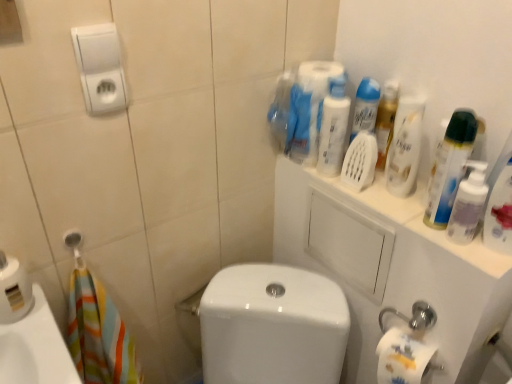
Find the location of a particular element. This screenshot has width=512, height=384. translucent plastic spray bottle at upper right, the fourth cleaning product from the left is located at coordinates (499, 213).

Where is `translucent plastic bottle at upper right, the 2th cleaning product positioned from the right`? The image size is (512, 384). translucent plastic bottle at upper right, the 2th cleaning product positioned from the right is located at coordinates (450, 167).

The width and height of the screenshot is (512, 384). Describe the element at coordinates (405, 146) in the screenshot. I see `white glossy shampoo at upper right, the third cleaning product when ordered from right to left` at that location.

Locate an element on the screen. Image resolution: width=512 pixels, height=384 pixels. translucent plastic bottle at upper right, which is counted as the fourth cleaning product, starting from the right is located at coordinates (333, 127).

Locate an element on the screen. translucent plastic spray bottle at upper right, the fourth cleaning product from the left is located at coordinates (499, 213).

From a real-world perspective, relative to translucent plastic bottle at upper right, which is counted as the fourth cleaning product, starting from the right, is white glossy shampoo at upper right, the third cleaning product when ordered from right to left, vertically above or below?

Clearly, from a real-world perspective, white glossy shampoo at upper right, the third cleaning product when ordered from right to left, is below translucent plastic bottle at upper right, which is counted as the fourth cleaning product, starting from the right.

Can you see white glossy shampoo at upper right, the third cleaning product when ordered from right to left, touching translucent plastic bottle at upper right, acting as the first cleaning product starting from the left?

No, white glossy shampoo at upper right, the third cleaning product when ordered from right to left, is not making contact with translucent plastic bottle at upper right, acting as the first cleaning product starting from the left.

Is point (398, 160) closer or farther from the camera than point (342, 92)?

Point (398, 160).

Would you say white glossy shampoo at upper right, the third cleaning product when ordered from right to left, is outside translucent plastic bottle at upper right, acting as the first cleaning product starting from the left?

white glossy shampoo at upper right, the third cleaning product when ordered from right to left, is positioned outside translucent plastic bottle at upper right, acting as the first cleaning product starting from the left.

From the image's perspective, who appears lower, translucent plastic spray bottle at upper right, the fourth cleaning product from the left, or translucent plastic bottle at upper right, the 2th cleaning product positioned from the right?

translucent plastic spray bottle at upper right, the fourth cleaning product from the left, appears lower in the image.

Is translucent plastic spray bottle at upper right, the fourth cleaning product from the left, not near translucent plastic bottle at upper right, the 3th cleaning product from the left?

No, there isn't a large distance between translucent plastic spray bottle at upper right, the fourth cleaning product from the left, and translucent plastic bottle at upper right, the 3th cleaning product from the left.

Considering the relative sizes of translucent plastic spray bottle at upper right, the fourth cleaning product from the left, and translucent plastic bottle at upper right, the 3th cleaning product from the left, in the image provided, is translucent plastic spray bottle at upper right, the fourth cleaning product from the left, bigger than translucent plastic bottle at upper right, the 3th cleaning product from the left,?

Yes, translucent plastic spray bottle at upper right, the fourth cleaning product from the left, is bigger than translucent plastic bottle at upper right, the 3th cleaning product from the left.

Who is more distant, translucent plastic spray bottle at upper right, the 1th cleaning product positioned from the right, or translucent plastic bottle at upper right, the 2th cleaning product positioned from the right?

translucent plastic bottle at upper right, the 2th cleaning product positioned from the right, is further away from the camera.

Considering the relative sizes of white glossy shampoo at upper right, the third cleaning product when ordered from right to left, and transparent plastic mouthwash at upper right in the image provided, is white glossy shampoo at upper right, the third cleaning product when ordered from right to left, bigger than transparent plastic mouthwash at upper right?

Indeed, white glossy shampoo at upper right, the third cleaning product when ordered from right to left, has a larger size compared to transparent plastic mouthwash at upper right.

Is white glossy shampoo at upper right, the third cleaning product when ordered from right to left, wider or thinner than transparent plastic mouthwash at upper right?

In the image, white glossy shampoo at upper right, the third cleaning product when ordered from right to left, appears to be wider than transparent plastic mouthwash at upper right.

From the image's perspective, is white glossy shampoo at upper right, the third cleaning product when ordered from right to left, positioned above or below transparent plastic mouthwash at upper right?

From the image's perspective, white glossy shampoo at upper right, the third cleaning product when ordered from right to left, appears above transparent plastic mouthwash at upper right.

Is transparent plastic mouthwash at upper right touching translucent plastic spray bottle at upper right, the fourth cleaning product from the left?

Indeed, transparent plastic mouthwash at upper right and translucent plastic spray bottle at upper right, the fourth cleaning product from the left, are beside each other and touching.

From the image's perspective, does transparent plastic mouthwash at upper right appear higher than translucent plastic spray bottle at upper right, the 1th cleaning product positioned from the right?

No, from the image's perspective, transparent plastic mouthwash at upper right is not over translucent plastic spray bottle at upper right, the 1th cleaning product positioned from the right.

Considering the positions of objects transparent plastic mouthwash at upper right and translucent plastic spray bottle at upper right, the fourth cleaning product from the left, in the image provided, who is more to the left, transparent plastic mouthwash at upper right or translucent plastic spray bottle at upper right, the fourth cleaning product from the left,?

Positioned to the left is transparent plastic mouthwash at upper right.

Is translucent plastic spray bottle at upper right, the 1th cleaning product positioned from the right, surrounded by transparent plastic mouthwash at upper right?

No, translucent plastic spray bottle at upper right, the 1th cleaning product positioned from the right, is not a part of transparent plastic mouthwash at upper right.

Are translucent plastic bottle at upper right, acting as the first cleaning product starting from the left, and transparent plastic mouthwash at upper right beside each other?

No, translucent plastic bottle at upper right, acting as the first cleaning product starting from the left, is not in contact with transparent plastic mouthwash at upper right.

In terms of width, does translucent plastic bottle at upper right, acting as the first cleaning product starting from the left, look wider or thinner when compared to transparent plastic mouthwash at upper right?

In the image, translucent plastic bottle at upper right, acting as the first cleaning product starting from the left, appears to be more narrow than transparent plastic mouthwash at upper right.

Can you tell me how much translucent plastic bottle at upper right, which is counted as the fourth cleaning product, starting from the right, and transparent plastic mouthwash at upper right differ in facing direction?

The angular difference between translucent plastic bottle at upper right, which is counted as the fourth cleaning product, starting from the right, and transparent plastic mouthwash at upper right is 42 degrees.

Is translucent plastic bottle at upper right, acting as the first cleaning product starting from the left, at the right side of transparent plastic mouthwash at upper right?

No, translucent plastic bottle at upper right, acting as the first cleaning product starting from the left, is not to the right of transparent plastic mouthwash at upper right.

Could you measure the distance between white glossy porcelain at upper right, marked as the first porcelain in a right-to-left arrangement, and translucent plastic spray bottle at upper right, the fourth cleaning product from the left?

white glossy porcelain at upper right, marked as the first porcelain in a right-to-left arrangement, is 11.71 inches away from translucent plastic spray bottle at upper right, the fourth cleaning product from the left.

Is there a large distance between white glossy porcelain at upper right, marked as the first porcelain in a right-to-left arrangement, and translucent plastic spray bottle at upper right, the fourth cleaning product from the left?

Actually, white glossy porcelain at upper right, marked as the first porcelain in a right-to-left arrangement, and translucent plastic spray bottle at upper right, the fourth cleaning product from the left, are a little close together.

Based on the photo, considering the relative positions of white glossy porcelain at upper right, which ranks as the second porcelain in left-to-right order, and translucent plastic spray bottle at upper right, the fourth cleaning product from the left, in the image provided, is white glossy porcelain at upper right, which ranks as the second porcelain in left-to-right order, in front of translucent plastic spray bottle at upper right, the fourth cleaning product from the left,?

No, it is not.

Is translucent plastic spray bottle at upper right, the fourth cleaning product from the left, next to white glossy porcelain at upper right, marked as the first porcelain in a right-to-left arrangement?

No, translucent plastic spray bottle at upper right, the fourth cleaning product from the left, is not making contact with white glossy porcelain at upper right, marked as the first porcelain in a right-to-left arrangement.

Considering the relative positions of translucent plastic spray bottle at upper right, the 1th cleaning product positioned from the right, and white glossy porcelain at upper right, marked as the first porcelain in a right-to-left arrangement, in the image provided, is translucent plastic spray bottle at upper right, the 1th cleaning product positioned from the right, to the left or to the right of white glossy porcelain at upper right, marked as the first porcelain in a right-to-left arrangement,?

translucent plastic spray bottle at upper right, the 1th cleaning product positioned from the right, is to the right of white glossy porcelain at upper right, marked as the first porcelain in a right-to-left arrangement.

Based on the photo, could white glossy porcelain at upper right, marked as the first porcelain in a right-to-left arrangement, be considered to be inside translucent plastic spray bottle at upper right, the fourth cleaning product from the left?

No, white glossy porcelain at upper right, marked as the first porcelain in a right-to-left arrangement, is not inside translucent plastic spray bottle at upper right, the fourth cleaning product from the left.

Starting from the white glossy porcelain at upper right, marked as the first porcelain in a right-to-left arrangement, which cleaning product is the 2nd one in front? Please provide its 2D coordinates.

[(499, 213)]

Where is `cleaning product that is the 1st object located below the translucent plastic bottle at upper right, which is counted as the fourth cleaning product, starting from the right (from the image's perspective)`? This screenshot has width=512, height=384. cleaning product that is the 1st object located below the translucent plastic bottle at upper right, which is counted as the fourth cleaning product, starting from the right (from the image's perspective) is located at coordinates (405, 146).

At what (x,y) coordinates should I click in order to perform the action: click on cleaning product on the right of translucent plastic bottle at upper right, the 2th cleaning product positioned from the right. Please return your answer as a coordinate pair (x, y). The height and width of the screenshot is (384, 512). Looking at the image, I should click on (499, 213).

Considering their positions, is translucent plastic spray bottle at upper right, the fourth cleaning product from the left, positioned further to white glossy porcelain at center, arranged as the first porcelain when viewed from the left, than translucent plastic bottle at upper right, the 3th cleaning product from the left?

translucent plastic spray bottle at upper right, the fourth cleaning product from the left, lies further to white glossy porcelain at center, arranged as the first porcelain when viewed from the left, than the other object.

When comparing their distances from transparent plastic mouthwash at upper right, does translucent plastic bottle at upper right, which is counted as the fourth cleaning product, starting from the right, or white glossy porcelain at upper right, marked as the first porcelain in a right-to-left arrangement, seem further?

translucent plastic bottle at upper right, which is counted as the fourth cleaning product, starting from the right.

From the image, which object appears to be nearer to translucent plastic bottle at upper right, which is counted as the fourth cleaning product, starting from the right, transparent plastic mouthwash at upper right or white plastic hand dryer at upper left?

The object closer to translucent plastic bottle at upper right, which is counted as the fourth cleaning product, starting from the right, is transparent plastic mouthwash at upper right.

Considering their positions, is white glossy porcelain at upper right, which ranks as the second porcelain in left-to-right order, positioned closer to white plastic hand dryer at upper left than white glossy shampoo at upper right, the third cleaning product when ordered from right to left?

Among the two, white glossy shampoo at upper right, the third cleaning product when ordered from right to left, is located nearer to white plastic hand dryer at upper left.

Looking at the image, which one is located further to white plastic hand dryer at upper left, white glossy porcelain at upper right, marked as the first porcelain in a right-to-left arrangement, or transparent plastic mouthwash at upper right?

transparent plastic mouthwash at upper right lies further to white plastic hand dryer at upper left than the other object.

Based on their spatial positions, is white plastic hand dryer at upper left or translucent plastic bottle at upper right, the 2th cleaning product positioned from the right, closer to white glossy porcelain at upper right, which ranks as the second porcelain in left-to-right order?

translucent plastic bottle at upper right, the 2th cleaning product positioned from the right, lies closer to white glossy porcelain at upper right, which ranks as the second porcelain in left-to-right order, than the other object.

From the image, which object appears to be farther from translucent plastic bottle at upper right, acting as the first cleaning product starting from the left, translucent plastic spray bottle at upper right, the fourth cleaning product from the left, or white glossy porcelain at center, arranged as the first porcelain when viewed from the left?

The object further to translucent plastic bottle at upper right, acting as the first cleaning product starting from the left, is white glossy porcelain at center, arranged as the first porcelain when viewed from the left.

Looking at the image, which one is located further to white glossy porcelain at center, placed as the 2th porcelain when sorted from right to left, translucent plastic bottle at upper right, the 3th cleaning product from the left, or translucent plastic bottle at upper right, which is counted as the fourth cleaning product, starting from the right?

translucent plastic bottle at upper right, the 3th cleaning product from the left, is positioned further to the anchor white glossy porcelain at center, placed as the 2th porcelain when sorted from right to left.

Find the location of a particular element. Image resolution: width=512 pixels, height=384 pixels. mouthwash between translucent plastic bottle at upper right, acting as the first cleaning product starting from the left, and translucent plastic spray bottle at upper right, the fourth cleaning product from the left, in the horizontal direction is located at coordinates (468, 204).

The image size is (512, 384). Find the location of `cleaning product between transparent plastic mouthwash at upper right and white glossy shampoo at upper right, the 2th cleaning product positioned from the left, in the front-back direction`. cleaning product between transparent plastic mouthwash at upper right and white glossy shampoo at upper right, the 2th cleaning product positioned from the left, in the front-back direction is located at coordinates (450, 167).

Where is `porcelain that lies between white plastic hand dryer at upper left and white glossy porcelain at center, arranged as the first porcelain when viewed from the left, from top to bottom`? porcelain that lies between white plastic hand dryer at upper left and white glossy porcelain at center, arranged as the first porcelain when viewed from the left, from top to bottom is located at coordinates (391, 268).

Image resolution: width=512 pixels, height=384 pixels. Identify the location of mouthwash between translucent plastic bottle at upper right, the 3th cleaning product from the left, and white glossy porcelain at upper right, marked as the first porcelain in a right-to-left arrangement, in the vertical direction. (468, 204).